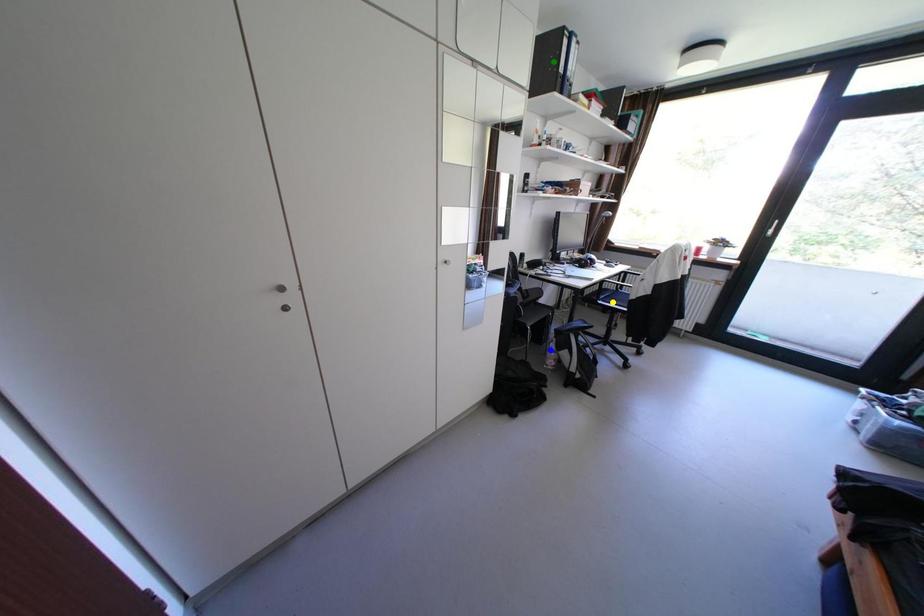
Order these from farthest to nearest:
1. yellow point
2. green point
3. blue point

yellow point < blue point < green point